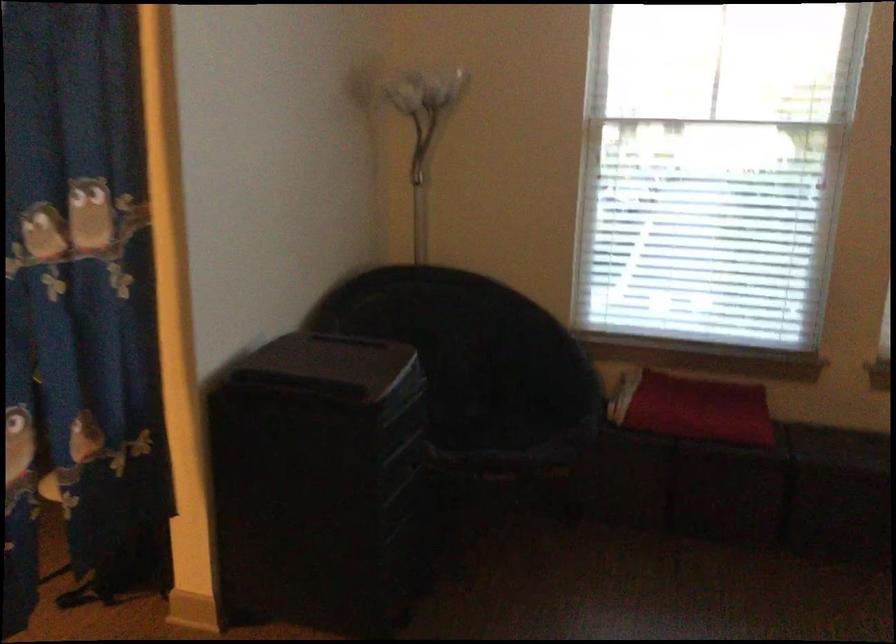
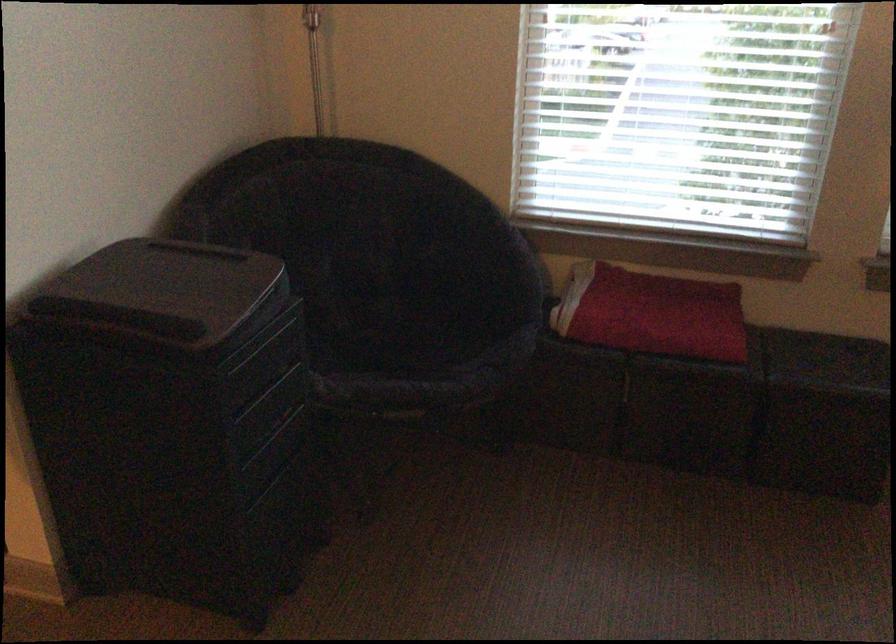
The point at (699,412) is marked in the first image. Where is the corresponding point in the second image?

(651, 313)